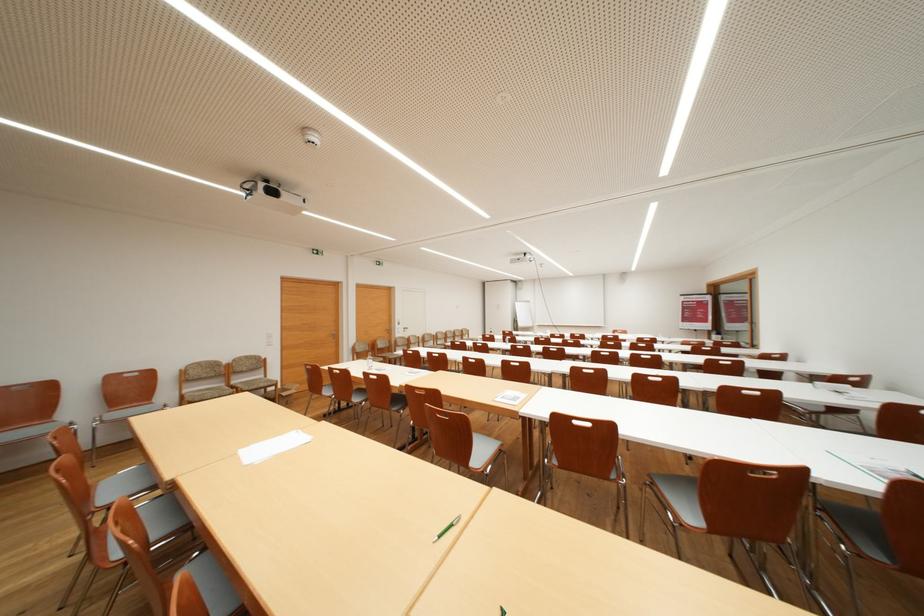
Locate an element on the screen. The height and width of the screenshot is (616, 924). white paper is located at coordinates (272, 447).